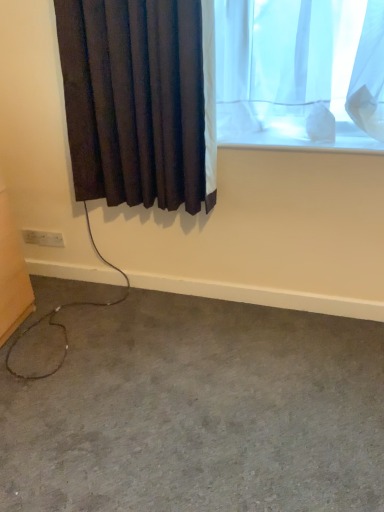
Question: Considering their positions, is white plastic electric outlet at lower left located in front of or behind dark fabric curtain at left?

Choices:
 (A) behind
 (B) front

Answer: (A)

Question: From a real-world perspective, relative to dark fabric curtain at left, is white plastic electric outlet at lower left vertically above or below?

Choices:
 (A) above
 (B) below

Answer: (B)

Question: Which object is the farthest from the dark fabric curtain at left?

Choices:
 (A) white plastic electric outlet at lower left
 (B) gray carpet at lower left

Answer: (B)

Question: Based on their relative distances, which object is nearer to the dark fabric curtain at left?

Choices:
 (A) gray carpet at lower left
 (B) white plastic electric outlet at lower left

Answer: (B)